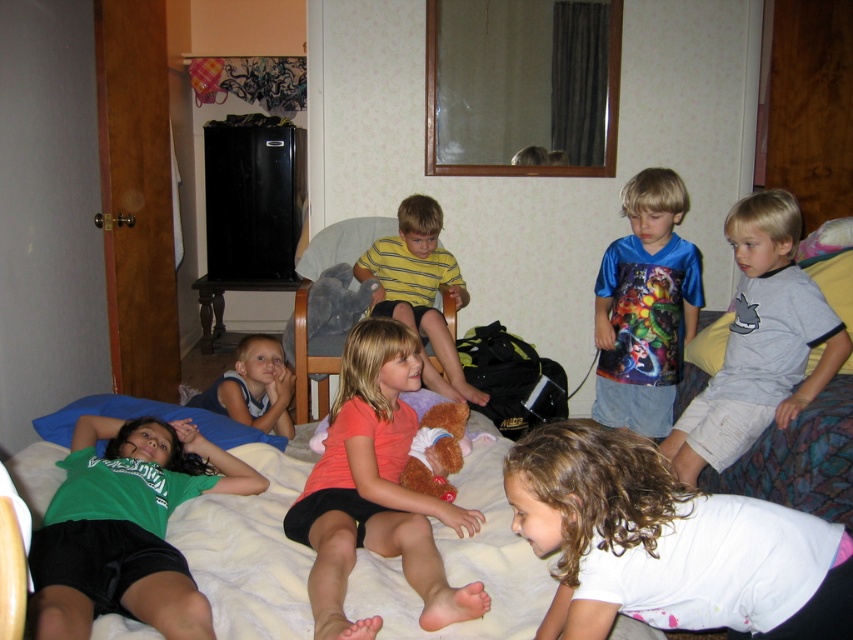
The width and height of the screenshot is (853, 640). What are the coordinates of `orange matte shirt at center` in the screenshot? It's located at (376, 490).

Who is more forward, [454,621] or [273,394]?

Point [454,621]

Find the location of a particular element. The image size is (853, 640). orange matte shirt at center is located at coordinates (376, 490).

Does orange matte shirt at center appear under brown plush bear at center?

Yes.

Can you confirm if orange matte shirt at center is positioned to the left of brown plush bear at center?

Indeed, orange matte shirt at center is positioned on the left side of brown plush bear at center.

You are a GUI agent. You are given a task and a screenshot of the screen. Output one action in this format:
    pyautogui.click(x=<x>, y=<y>)
    Task: Click on the orange matte shirt at center
    The width and height of the screenshot is (853, 640).
    Given the screenshot: What is the action you would take?
    pyautogui.click(x=376, y=490)

Between green matte shirt at lower left and blue shiny shirt at center, which one is positioned lower?

green matte shirt at lower left is lower down.

Identify the location of green matte shirt at lower left. (126, 528).

You are a GUI agent. You are given a task and a screenshot of the screen. Output one action in this format:
    pyautogui.click(x=<x>, y=<y>)
    Task: Click on the green matte shirt at lower left
    The width and height of the screenshot is (853, 640).
    Given the screenshot: What is the action you would take?
    pyautogui.click(x=126, y=528)

I want to click on green matte shirt at lower left, so click(x=126, y=528).